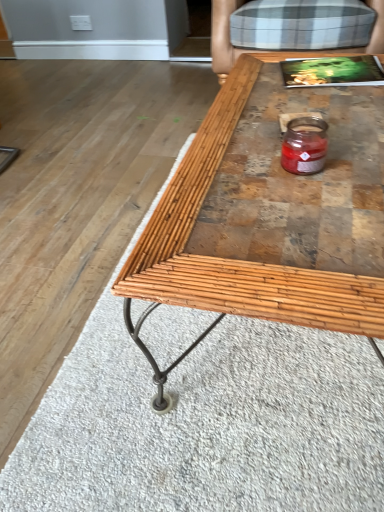
Question: Are translucent glass candle at center and bamboo wood coffee table at center far apart?

Choices:
 (A) no
 (B) yes

Answer: (A)

Question: Is translucent glass candle at center in front of bamboo wood coffee table at center?

Choices:
 (A) yes
 (B) no

Answer: (B)

Question: Is translucent glass candle at center facing away from bamboo wood coffee table at center?

Choices:
 (A) no
 (B) yes

Answer: (A)

Question: From a real-world perspective, is translucent glass candle at center positioned under bamboo wood coffee table at center based on gravity?

Choices:
 (A) no
 (B) yes

Answer: (A)

Question: Can you confirm if translucent glass candle at center is wider than bamboo wood coffee table at center?

Choices:
 (A) yes
 (B) no

Answer: (B)

Question: Could you tell me if translucent glass candle at center is turned towards bamboo wood coffee table at center?

Choices:
 (A) yes
 (B) no

Answer: (B)

Question: Is plaid fabric armchair at upper right oriented away from bamboo wood coffee table at center?

Choices:
 (A) yes
 (B) no

Answer: (B)

Question: Can you confirm if plaid fabric armchair at upper right is shorter than bamboo wood coffee table at center?

Choices:
 (A) no
 (B) yes

Answer: (A)

Question: Is the position of plaid fabric armchair at upper right less distant than that of bamboo wood coffee table at center?

Choices:
 (A) yes
 (B) no

Answer: (B)

Question: Does plaid fabric armchair at upper right appear on the right side of bamboo wood coffee table at center?

Choices:
 (A) yes
 (B) no

Answer: (A)

Question: Considering the relative sizes of plaid fabric armchair at upper right and bamboo wood coffee table at center in the image provided, is plaid fabric armchair at upper right bigger than bamboo wood coffee table at center?

Choices:
 (A) yes
 (B) no

Answer: (A)

Question: Considering the relative sizes of plaid fabric armchair at upper right and bamboo wood coffee table at center in the image provided, is plaid fabric armchair at upper right thinner than bamboo wood coffee table at center?

Choices:
 (A) yes
 (B) no

Answer: (B)

Question: Considering the relative sizes of translucent glass candle at center and plaid fabric armchair at upper right in the image provided, is translucent glass candle at center shorter than plaid fabric armchair at upper right?

Choices:
 (A) no
 (B) yes

Answer: (B)